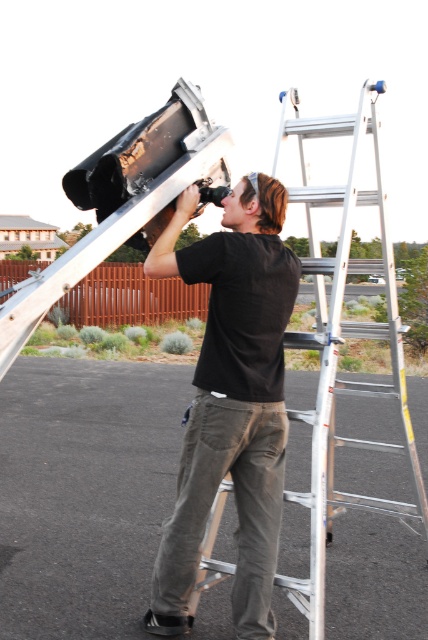
You are a photographer trying to capture the silver metallic ladder at center and the black matte shirt at center in a single frame. Based on their positions, will the ladder appear above the shirt in the photo?

The black matte shirt at center is positioned under the silver metallic ladder at center, so yes, the ladder will appear above the shirt in the photo.